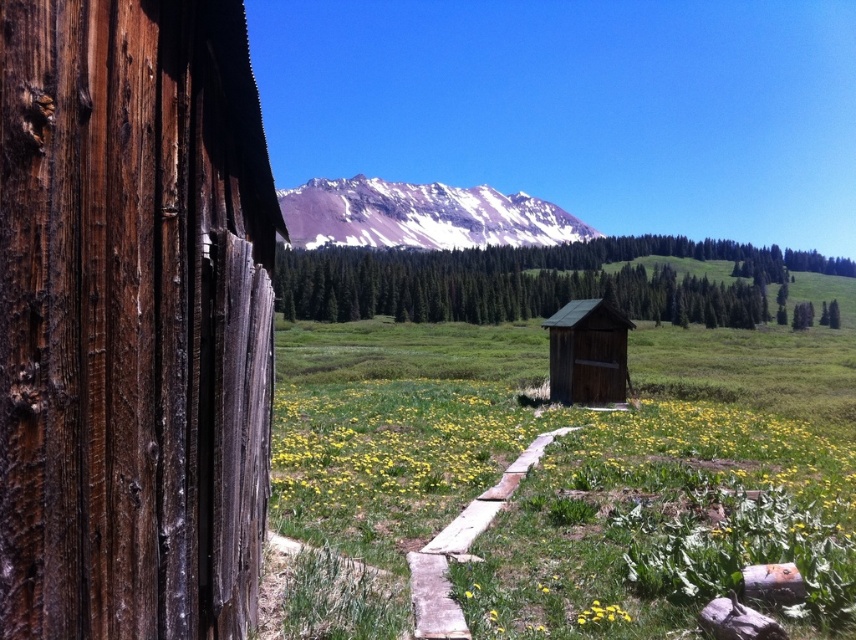
Is point (426, 636) more distant than point (586, 362)?

No, (426, 636) is in front of (586, 362).

Who is shorter, wooden plank path at center or green wood log cabin at center?

Standing shorter between the two is wooden plank path at center.

Who is more forward, (621,408) or (566,310)?

Point (621,408)

Where is `wooden plank path at center`? The image size is (856, 640). wooden plank path at center is located at coordinates (462, 548).

Is green wood log cabin at center in front of yellow matte flower at lower center?

No, it is not.

Which is below, green wood log cabin at center or yellow matte flower at lower center?

yellow matte flower at lower center

You are a GUI agent. You are given a task and a screenshot of the screen. Output one action in this format:
    pyautogui.click(x=<x>, y=<y>)
    Task: Click on the green wood log cabin at center
    
    Given the screenshot: What is the action you would take?
    pyautogui.click(x=587, y=353)

This screenshot has width=856, height=640. In order to click on green wood log cabin at center in this screenshot , I will do `click(587, 353)`.

Which of these two, weathered brown wood at left or green wood log cabin at center, stands shorter?

weathered brown wood at left

Between point (63, 97) and point (614, 388), which one is positioned in front?

Point (63, 97)

Where is `weathered brown wood at left`? This screenshot has height=640, width=856. weathered brown wood at left is located at coordinates (132, 320).